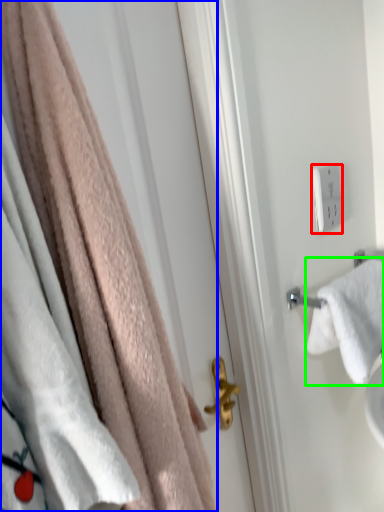
Question: Which is nearer to the light switch (highlighted by a red box)? towel (highlighted by a blue box) or towel (highlighted by a green box).

Choices:
 (A) towel
 (B) towel

Answer: (B)